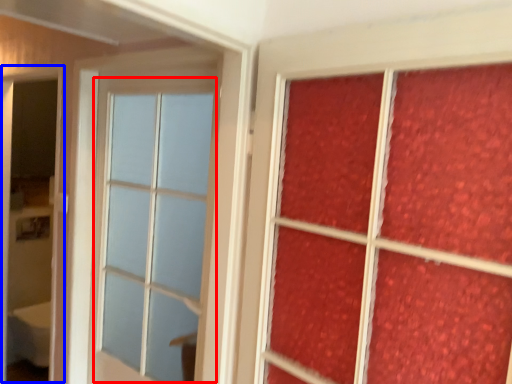
Question: Which of the following is the farthest to the observer, glass window (highlighted by a red box) or screen door (highlighted by a blue box)?

Choices:
 (A) glass window
 (B) screen door

Answer: (B)